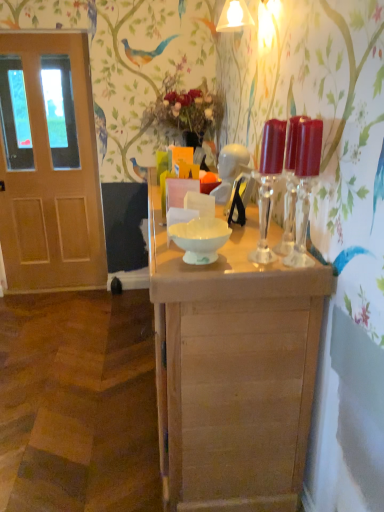
What do you see at coordinates (50, 168) in the screenshot? The height and width of the screenshot is (512, 384). I see `wooden door at left` at bounding box center [50, 168].

What do you see at coordinates (305, 185) in the screenshot? I see `translucent glass candle holders at right, positioned as the 1th candle holder in right-to-left order` at bounding box center [305, 185].

In order to face translucent glass candle holders at right, which is counted as the 2th candle holder, starting from the left, should I rotate leftwards or rightwards?

Rotate right and turn 14.928 degrees.

Image resolution: width=384 pixels, height=512 pixels. Find the location of `light brown wooden table at center`. light brown wooden table at center is located at coordinates coord(233,372).

Looking at this image, which object is further away from the camera taking this photo, transparent glass candle holders at center, marked as the 1th candle holder in a left-to-right arrangement, or wooden door at left?

wooden door at left is further from the camera.

Does transparent glass candle holders at center, placed as the 2th candle holder when sorted from right to left, have a greater width compared to wooden door at left?

No.

From their relative heights in the image, would you say transparent glass candle holders at center, marked as the 1th candle holder in a left-to-right arrangement, is taller or shorter than wooden door at left?

Considering their sizes, transparent glass candle holders at center, marked as the 1th candle holder in a left-to-right arrangement, has less height than wooden door at left.

Is transparent glass candle holders at center, marked as the 1th candle holder in a left-to-right arrangement, beside wooden door at left?

transparent glass candle holders at center, marked as the 1th candle holder in a left-to-right arrangement, is not next to wooden door at left, and they're not touching.

In terms of height, does wooden door at left look taller or shorter compared to transparent glass candle holders at center, marked as the 1th candle holder in a left-to-right arrangement?

In the image, wooden door at left appears to be taller than transparent glass candle holders at center, marked as the 1th candle holder in a left-to-right arrangement.

Is wooden door at left closer to camera compared to transparent glass candle holders at center, placed as the 2th candle holder when sorted from right to left?

No, wooden door at left is behind transparent glass candle holders at center, placed as the 2th candle holder when sorted from right to left.

From the image's perspective, is wooden door at left above transparent glass candle holders at center, marked as the 1th candle holder in a left-to-right arrangement?

Indeed, from the image's perspective, wooden door at left is shown above transparent glass candle holders at center, marked as the 1th candle holder in a left-to-right arrangement.

Is light brown wooden table at center smaller than wooden door at left?

Actually, light brown wooden table at center might be larger than wooden door at left.

Is point (273, 288) in front of point (29, 84)?

Yes, it is.

Who is taller, light brown wooden table at center or wooden door at left?

wooden door at left.

How far apart are light brown wooden table at center and transparent glass candle holders at center, marked as the 1th candle holder in a left-to-right arrangement?

light brown wooden table at center and transparent glass candle holders at center, marked as the 1th candle holder in a left-to-right arrangement, are 14.96 inches apart from each other.

Looking at this image, from the image's perspective, which is below, light brown wooden table at center or transparent glass candle holders at center, placed as the 2th candle holder when sorted from right to left?

From the image's view, light brown wooden table at center is below.

Would you say light brown wooden table at center contains transparent glass candle holders at center, placed as the 2th candle holder when sorted from right to left?

No.

Considering the relative positions of light brown wooden table at center and transparent glass candle holders at center, placed as the 2th candle holder when sorted from right to left, in the image provided, is light brown wooden table at center to the left or to the right of transparent glass candle holders at center, placed as the 2th candle holder when sorted from right to left,?

light brown wooden table at center is to the left of transparent glass candle holders at center, placed as the 2th candle holder when sorted from right to left.

Which point is more forward, [319,169] or [68,270]?

The point [319,169] is in front.

Between translucent glass candle holders at right, positioned as the 1th candle holder in right-to-left order, and wooden door at left, which one is positioned in front?

translucent glass candle holders at right, positioned as the 1th candle holder in right-to-left order, is closer to the camera.

Looking at this image, can wooden door at left be found inside translucent glass candle holders at right, which is counted as the 2th candle holder, starting from the left?

No, wooden door at left is not inside translucent glass candle holders at right, which is counted as the 2th candle holder, starting from the left.

Is translucent glass candle holders at right, which is counted as the 2th candle holder, starting from the left, facing towards wooden door at left?

No, translucent glass candle holders at right, which is counted as the 2th candle holder, starting from the left, is not turned towards wooden door at left.

Is the position of translucent glass candle holders at right, which is counted as the 2th candle holder, starting from the left, less distant than that of light brown wooden table at center?

Yes, it is.

Can you confirm if translucent glass candle holders at right, which is counted as the 2th candle holder, starting from the left, is wider than light brown wooden table at center?

No, translucent glass candle holders at right, which is counted as the 2th candle holder, starting from the left, is not wider than light brown wooden table at center.

From the image's perspective, which is above, translucent glass candle holders at right, positioned as the 1th candle holder in right-to-left order, or light brown wooden table at center?

translucent glass candle holders at right, positioned as the 1th candle holder in right-to-left order.

Where is `table lying on the left of translucent glass candle holders at right, which is counted as the 2th candle holder, starting from the left`? The height and width of the screenshot is (512, 384). table lying on the left of translucent glass candle holders at right, which is counted as the 2th candle holder, starting from the left is located at coordinates (233, 372).

Looking at this image, is light brown wooden table at center smaller than translucent glass candle holders at right, positioned as the 1th candle holder in right-to-left order?

Incorrect, light brown wooden table at center is not smaller in size than translucent glass candle holders at right, positioned as the 1th candle holder in right-to-left order.

Is translucent glass candle holders at right, positioned as the 1th candle holder in right-to-left order, at the back of light brown wooden table at center?

Answer: No, light brown wooden table at center's orientation is not away from translucent glass candle holders at right, positioned as the 1th candle holder in right-to-left order.

Can you confirm if light brown wooden table at center is shorter than translucent glass candle holders at right, positioned as the 1th candle holder in right-to-left order?

No.

Is light brown wooden table at center to the left of translucent glass candle holders at right, positioned as the 1th candle holder in right-to-left order, from the viewer's perspective?

Correct, you'll find light brown wooden table at center to the left of translucent glass candle holders at right, positioned as the 1th candle holder in right-to-left order.

The width and height of the screenshot is (384, 512). What are the coordinates of `door below the transparent glass candle holders at center, placed as the 2th candle holder when sorted from right to left (from a real-world perspective)` in the screenshot? It's located at (50, 168).

From a real-world perspective, which candle holder is the 1st one above the wooden door at left? Please provide its 2D coordinates.

[(268, 183)]

When comparing their distances from white glossy bowl at center, does light brown wooden table at center or wooden door at left seem closer?

light brown wooden table at center is closer to white glossy bowl at center.

Looking at the image, which one is located closer to wooden door at left, transparent glass candle holders at center, placed as the 2th candle holder when sorted from right to left, or translucent glass candle holders at right, positioned as the 1th candle holder in right-to-left order?

Among the two, transparent glass candle holders at center, placed as the 2th candle holder when sorted from right to left, is located nearer to wooden door at left.

When comparing their distances from wooden door at left, does light brown wooden table at center or transparent glass candle holders at center, marked as the 1th candle holder in a left-to-right arrangement, seem closer?

Based on the image, transparent glass candle holders at center, marked as the 1th candle holder in a left-to-right arrangement, appears to be nearer to wooden door at left.

When comparing their distances from translucent glass candle holders at right, which is counted as the 2th candle holder, starting from the left, does wooden door at left or light brown wooden table at center seem further?

wooden door at left is positioned further to the anchor translucent glass candle holders at right, which is counted as the 2th candle holder, starting from the left.

Estimate the real-world distances between objects in this image. Which object is further from translucent glass candle holders at right, positioned as the 1th candle holder in right-to-left order, wooden door at left or transparent glass candle holders at center, marked as the 1th candle holder in a left-to-right arrangement?

wooden door at left lies further to translucent glass candle holders at right, positioned as the 1th candle holder in right-to-left order, than the other object.

Looking at the image, which one is located closer to translucent glass candle holders at right, positioned as the 1th candle holder in right-to-left order, wooden door at left or white glossy bowl at center?

white glossy bowl at center.

When comparing their distances from white glossy bowl at center, does transparent glass candle holders at center, placed as the 2th candle holder when sorted from right to left, or translucent glass candle holders at right, positioned as the 1th candle holder in right-to-left order, seem closer?

transparent glass candle holders at center, placed as the 2th candle holder when sorted from right to left, is positioned closer to the anchor white glossy bowl at center.

Estimate the real-world distances between objects in this image. Which object is further from transparent glass candle holders at center, marked as the 1th candle holder in a left-to-right arrangement, light brown wooden table at center or translucent glass candle holders at right, which is counted as the 2th candle holder, starting from the left?

light brown wooden table at center.

Identify the location of bowl located between translucent glass candle holders at right, positioned as the 1th candle holder in right-to-left order, and wooden door at left in the depth direction. (200, 239).

Where is `bowl between transparent glass candle holders at center, placed as the 2th candle holder when sorted from right to left, and wooden door at left from front to back`? The width and height of the screenshot is (384, 512). bowl between transparent glass candle holders at center, placed as the 2th candle holder when sorted from right to left, and wooden door at left from front to back is located at coordinates (200, 239).

You are a GUI agent. You are given a task and a screenshot of the screen. Output one action in this format:
    pyautogui.click(x=<x>, y=<y>)
    Task: Click on the bowl between light brown wooden table at center and wooden door at left in the front-back direction
    
    Given the screenshot: What is the action you would take?
    pyautogui.click(x=200, y=239)

Locate an element on the screen. table located between translucent glass candle holders at right, positioned as the 1th candle holder in right-to-left order, and wooden door at left in the depth direction is located at coordinates (233, 372).